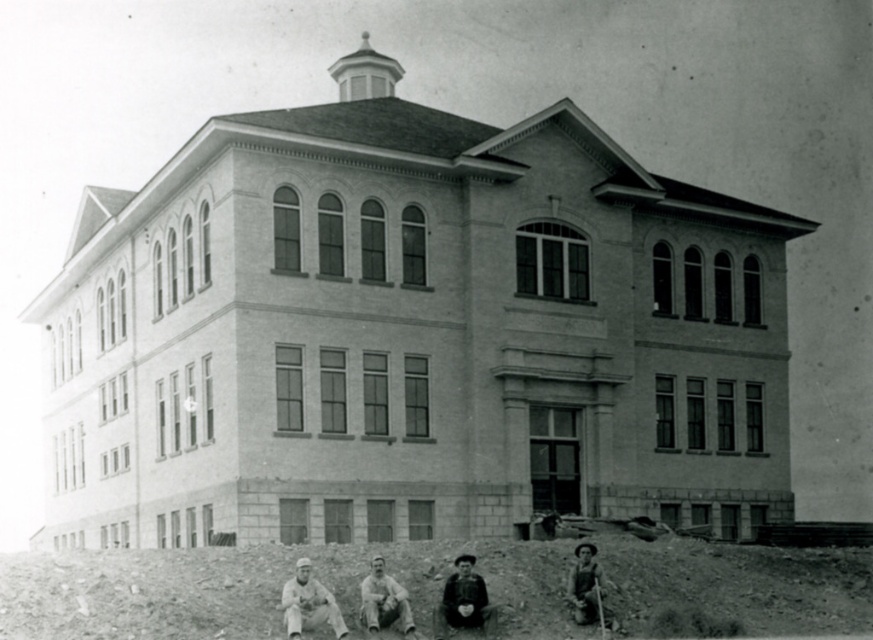
Can you confirm if white cloth pants at lower left is positioned below wooden stick at lower right?

No.

Consider the image. Does white cloth pants at lower left have a lesser height compared to wooden stick at lower right?

In fact, white cloth pants at lower left may be taller than wooden stick at lower right.

Between point (298, 596) and point (597, 577), which one is positioned in front?

Point (298, 596)

Where is `white cloth pants at lower left`? The image size is (873, 640). white cloth pants at lower left is located at coordinates point(308,604).

Is point (393, 595) in front of point (597, 586)?

Yes, it is.

Which of these two, smooth beige pants at center or smooth wooden shovel at lower right, stands shorter?

Standing shorter between the two is smooth wooden shovel at lower right.

Between point (363, 604) and point (602, 632), which one is positioned in front?

Positioned in front is point (602, 632).

Locate an element on the screen. The height and width of the screenshot is (640, 873). smooth beige pants at center is located at coordinates (383, 602).

Does white cloth pants at lower left have a lesser height compared to smooth beige pants at center?

Yes.

Does white cloth pants at lower left appear over smooth beige pants at center?

Indeed, white cloth pants at lower left is positioned over smooth beige pants at center.

Does point (317, 596) lie behind point (400, 612)?

No.

You are a GUI agent. You are given a task and a screenshot of the screen. Output one action in this format:
    pyautogui.click(x=<x>, y=<y>)
    Task: Click on the white cloth pants at lower left
    The width and height of the screenshot is (873, 640).
    Given the screenshot: What is the action you would take?
    pyautogui.click(x=308, y=604)